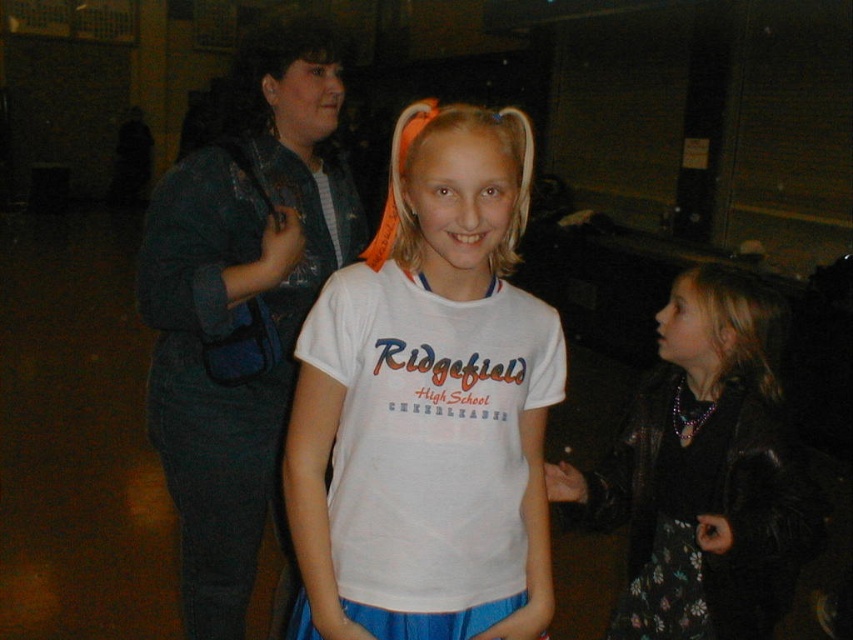
Question: Is white cotton t-shirt at center to the left of shiny black hair at right from the viewer's perspective?

Choices:
 (A) no
 (B) yes

Answer: (B)

Question: Does white cotton t-shirt at center lie in front of shiny black hair at right?

Choices:
 (A) yes
 (B) no

Answer: (A)

Question: In this image, where is white cotton t-shirt at center located relative to shiny black hair at right?

Choices:
 (A) left
 (B) right

Answer: (A)